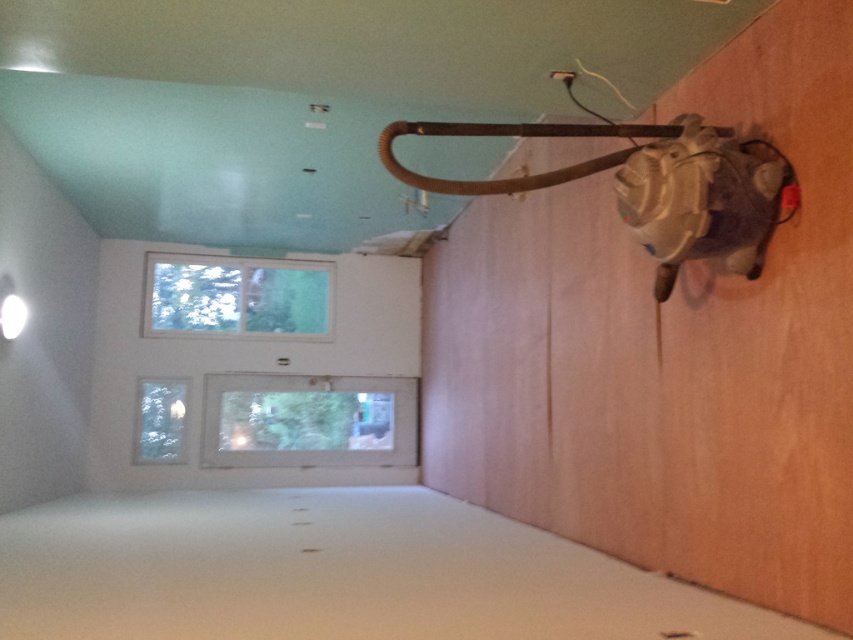
You are a construction worker who needs to install a new safety net between the clear glass window at upper center and the clear glass window at lower left. The net requires a minimum of 3 feet of space to be installed properly. Based on the scene, can the safety net be installed between these two windows?

The distance between the clear glass window at upper center and the clear glass window at lower left is 3.66 feet, which is more than the required 3 feet. Therefore, the safety net can be installed between them.

You are an inspector checking the ventilation system in the construction area. You notice two clear glass windows, the clear glass window at center and the clear glass window at lower left. Which window is positioned closer to the inspector when standing at the entrance?

The clear glass window at lower left is behind clear glass window at center, so the clear glass window at center is closer to the inspector.

You are standing in the construction area and need to locate the clear glass window at center and the clear glass window at upper center. Which window is located to the right of the other?

The clear glass window at center is positioned on the right side of clear glass window at upper center.